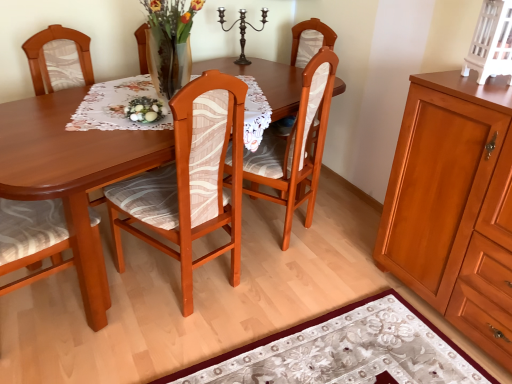
Identify the location of vacant location below wooden chair at center, the third chair positioned from the left (from a real-world perspective). (269, 227).